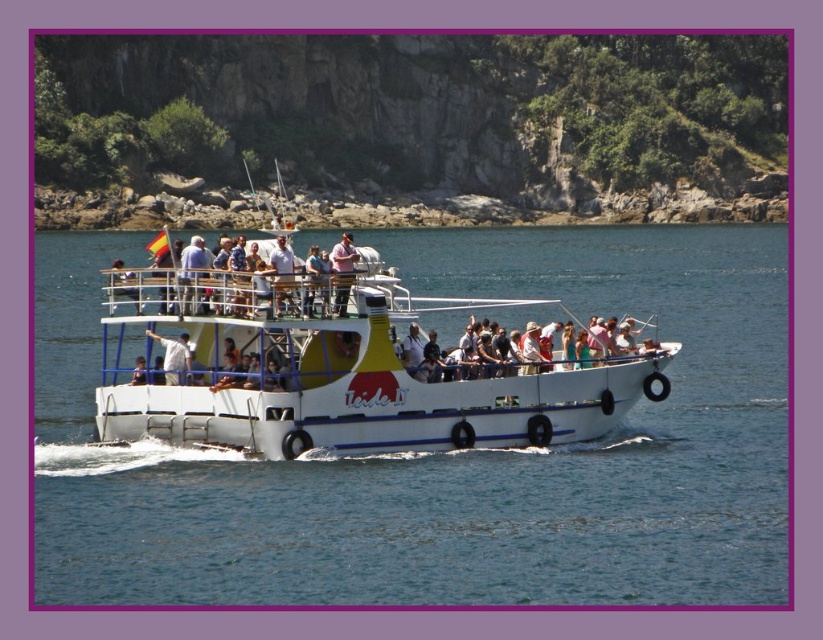
You are standing on the upper deck of the tour boat named Veside II. You notice two points marked on the boat. The first point is at coordinate point (338, 248) and the second is at point (166, 368). If you want to move from the first point to the second point, which direction should you move relative to the boat?

Point (338, 248) is in front of point (166, 368), so to move from the first point to the second point, you should move backward relative to the boat.